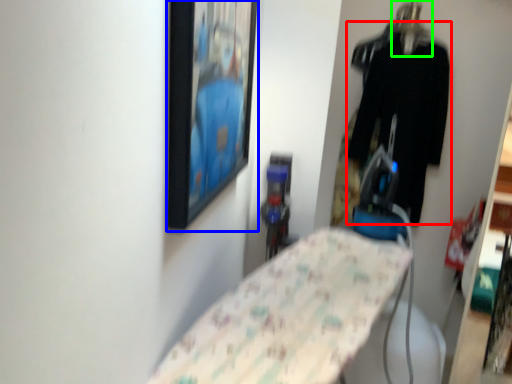
Question: Estimate the real-world distances between objects in this image. Which object is farther from clothing (highlighted by a red box), picture frame (highlighted by a blue box) or hanger (highlighted by a green box)?

Choices:
 (A) picture frame
 (B) hanger

Answer: (A)